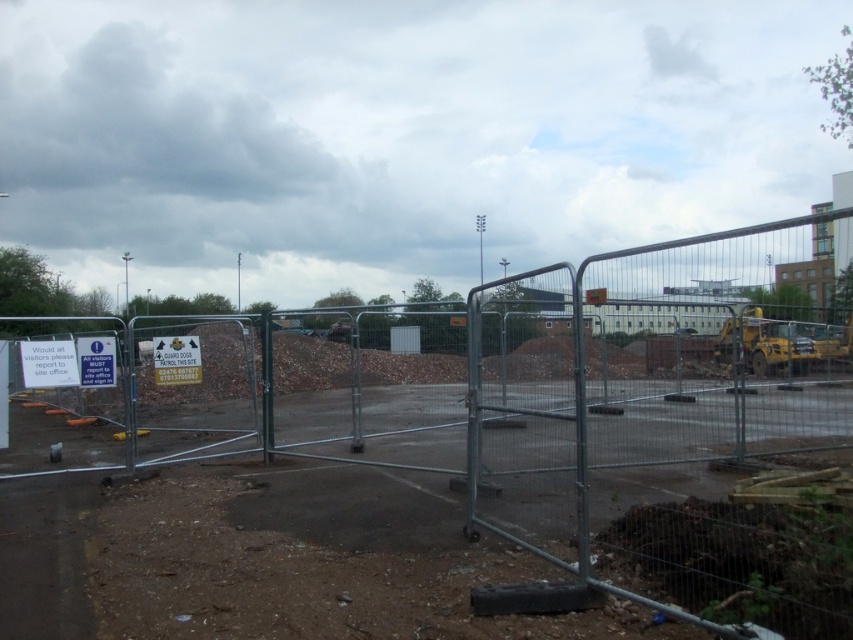
Is metallic silver fence at center smaller than white paper sign at left?

No.

Is metallic silver fence at center above white paper sign at left?

No, metallic silver fence at center is not above white paper sign at left.

Does point (519, 468) lie in front of point (94, 353)?

No, it is not.

Locate an element on the screen. metallic silver fence at center is located at coordinates (670, 432).

In the scene shown: Which is more to the right, white paper sign at lower left or white paper sign at left?

white paper sign at left is more to the right.

Between white paper sign at lower left and white paper sign at left, which one has less height?

With less height is white paper sign at lower left.

Between point (67, 374) and point (90, 387), which one is positioned in front?

Positioned in front is point (67, 374).

This screenshot has height=640, width=853. Identify the location of white paper sign at lower left. (48, 364).

Does yellow plastic sign at center appear under white paper sign at left?

No, yellow plastic sign at center is not below white paper sign at left.

Is point (160, 356) positioned before point (94, 348)?

That is False.

Locate an element on the screen. yellow plastic sign at center is located at coordinates (177, 358).